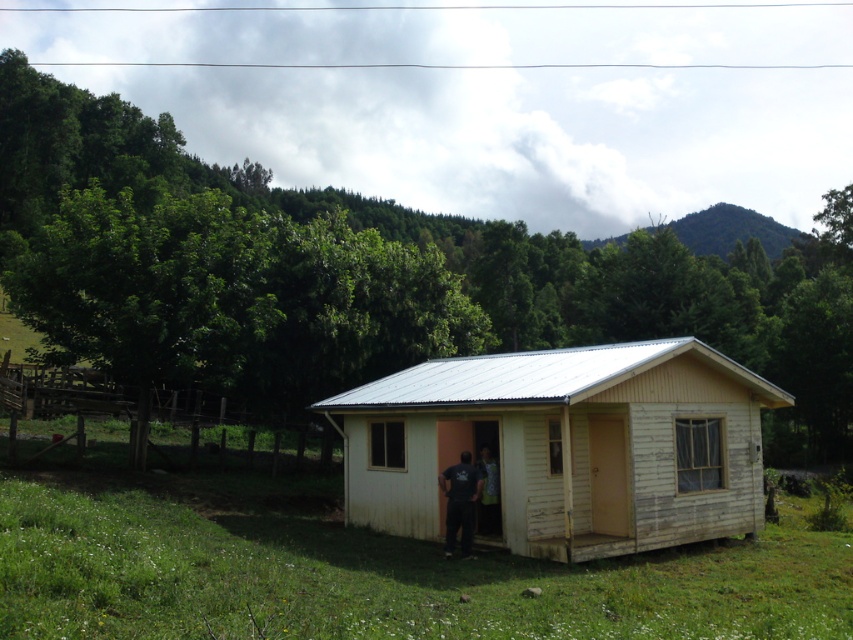
Based on the photo, can you confirm if dark gray fabric pants at center is smaller than dark blue fabric at center?

No, dark gray fabric pants at center is not smaller than dark blue fabric at center.

Consider the image. Is dark gray fabric pants at center to the left of dark blue fabric at center from the viewer's perspective?

Correct, you'll find dark gray fabric pants at center to the left of dark blue fabric at center.

Who is more distant from viewer, [454,512] or [486,518]?

The point [486,518] is behind.

At what (x,y) coordinates should I click in order to perform the action: click on dark gray fabric pants at center. Please return your answer as a coordinate pair (x, y). Image resolution: width=853 pixels, height=640 pixels. Looking at the image, I should click on (460, 502).

Which is more to the left, yellow wood cabin at center or dark blue fabric at center?

Positioned to the left is dark blue fabric at center.

You are a GUI agent. You are given a task and a screenshot of the screen. Output one action in this format:
    pyautogui.click(x=<x>, y=<y>)
    Task: Click on the yellow wood cabin at center
    
    Given the screenshot: What is the action you would take?
    pyautogui.click(x=566, y=445)

Where is `yellow wood cabin at center`? yellow wood cabin at center is located at coordinates (566, 445).

Is yellow wood cabin at center bigger than dark gray fabric pants at center?

Yes, yellow wood cabin at center is bigger than dark gray fabric pants at center.

Between point (720, 451) and point (445, 532), which one is positioned in front?

Positioned in front is point (445, 532).

You are a GUI agent. You are given a task and a screenshot of the screen. Output one action in this format:
    pyautogui.click(x=<x>, y=<y>)
    Task: Click on the yellow wood cabin at center
    
    Given the screenshot: What is the action you would take?
    pyautogui.click(x=566, y=445)